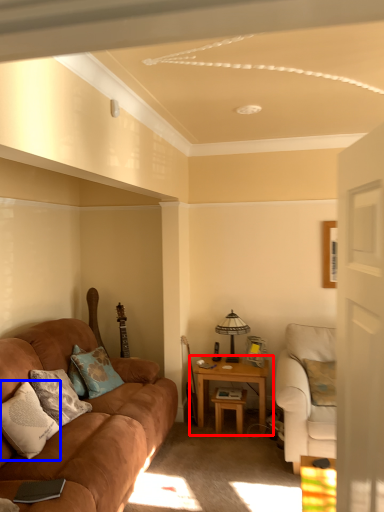
Question: Which object appears closest to the camera in this image, table (highlighted by a red box) or pillow (highlighted by a blue box)?

Choices:
 (A) table
 (B) pillow

Answer: (B)